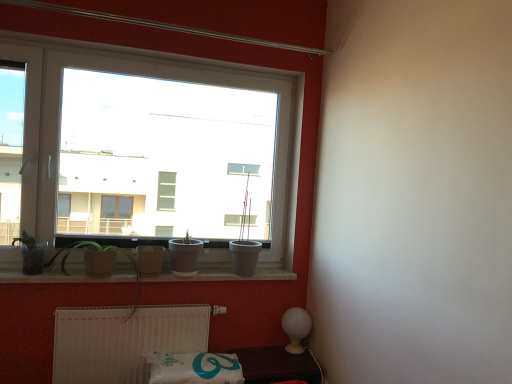
At what (x,y) coordinates should I click in order to perform the action: click on free space above white plastic window at upper left (from a real-world perspective). Please return your answer as a coordinate pair (x, y). Looking at the image, I should click on (160, 61).